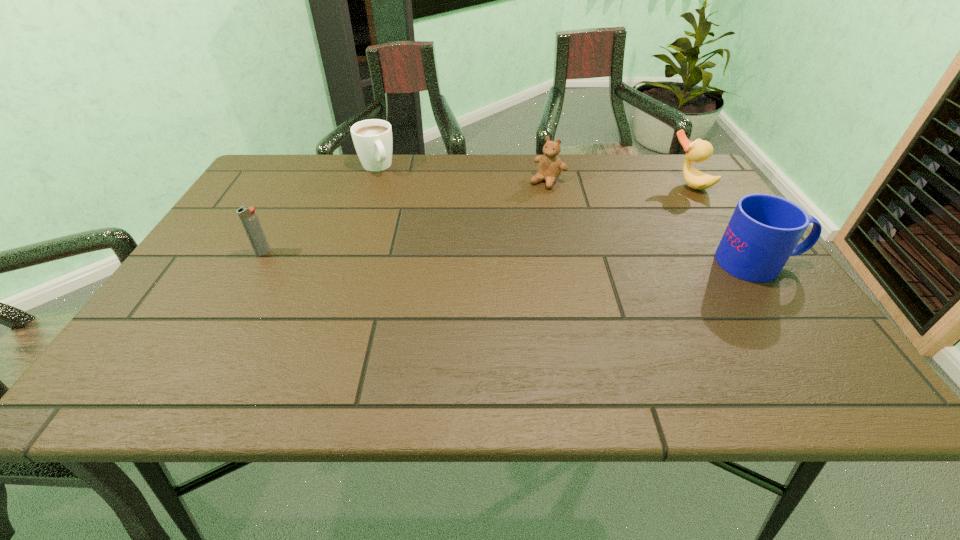
In order to click on blank region between the igniter and the mug in this screenshot , I will do `click(511, 258)`.

The image size is (960, 540). In order to click on empty space that is in between the igniter and the duck in this screenshot , I will do `click(475, 218)`.

Identify the location of vacant area that lies between the mug and the cappuccino. (567, 214).

Where is `empty location between the teddy bear and the fourth object from right to left`? Image resolution: width=960 pixels, height=540 pixels. empty location between the teddy bear and the fourth object from right to left is located at coordinates (462, 174).

Find the location of a particular element. empty space that is in between the mug and the cappuccino is located at coordinates (567, 214).

The width and height of the screenshot is (960, 540). I want to click on vacant region between the igniter and the fourth object from right to left, so click(x=320, y=210).

At what (x,y) coordinates should I click in order to perform the action: click on empty location between the second object from left to right and the igniter. Please return your answer as a coordinate pair (x, y). This screenshot has width=960, height=540. Looking at the image, I should click on (320, 210).

Where is `free point between the third object from left to right and the fourth object from right to left`? This screenshot has width=960, height=540. free point between the third object from left to right and the fourth object from right to left is located at coordinates (462, 174).

This screenshot has width=960, height=540. In order to click on free space between the teddy bear and the igniter in this screenshot , I will do `click(405, 217)`.

At what (x,y) coordinates should I click in order to perform the action: click on the fourth closest object relative to the duck. Please return your answer as a coordinate pair (x, y). Looking at the image, I should click on (248, 216).